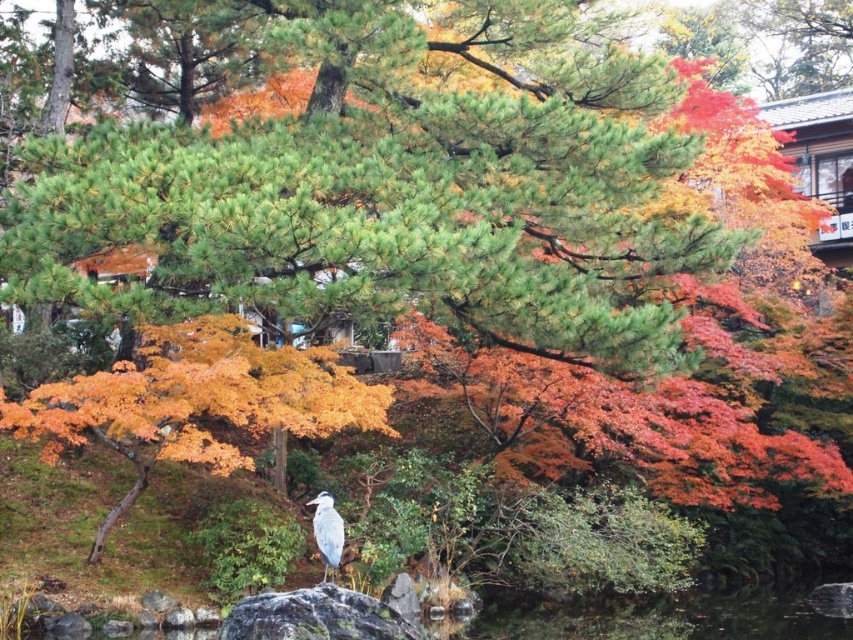
Question: Does orange matte maple at center come in front of white matte bird at center?

Choices:
 (A) yes
 (B) no

Answer: (B)

Question: Which point is farther from the camera taking this photo?

Choices:
 (A) (323, 497)
 (B) (305, 401)

Answer: (B)

Question: Is orange matte maple at center to the left of white matte bird at center from the viewer's perspective?

Choices:
 (A) no
 (B) yes

Answer: (B)

Question: Observing the image, what is the correct spatial positioning of orange matte maple at center in reference to white matte bird at center?

Choices:
 (A) left
 (B) right

Answer: (A)

Question: Which point is farther to the camera?

Choices:
 (A) (144, 330)
 (B) (314, 528)

Answer: (A)